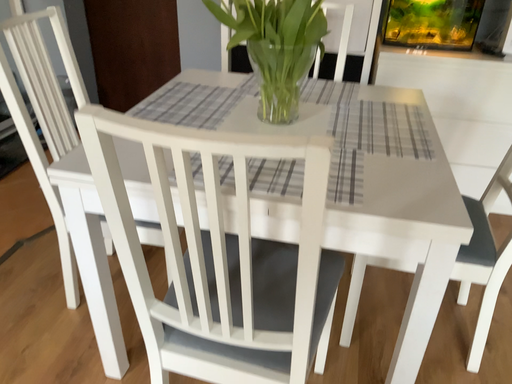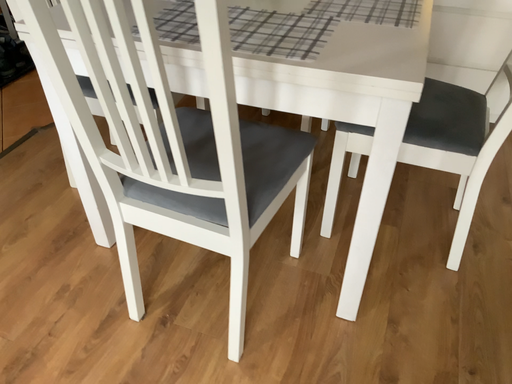
Question: Which way did the camera rotate in the video?

Choices:
 (A) rotated right
 (B) rotated left

Answer: (B)